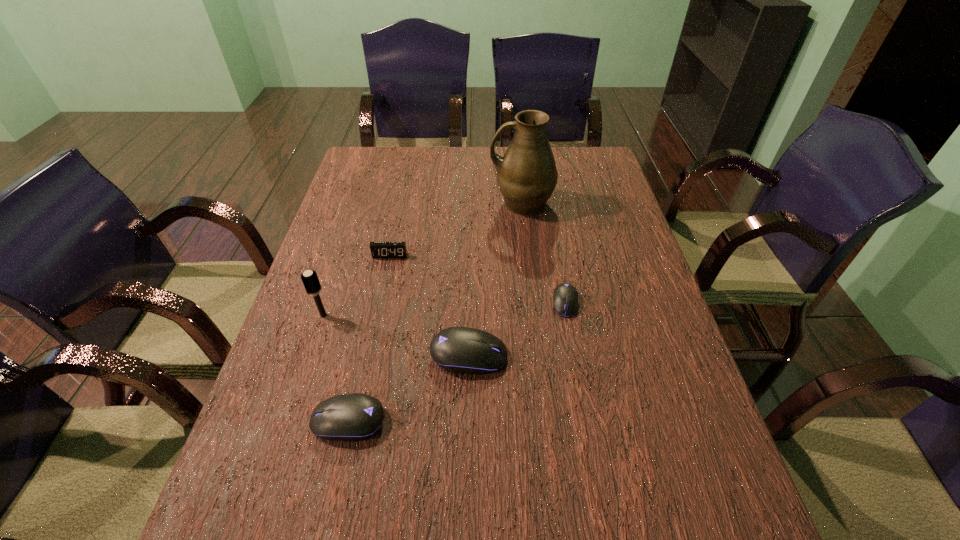
Identify the location of the nearest object. (351, 417).

Where is `the nearest computer mouse`? the nearest computer mouse is located at coordinates (351, 417).

Locate an element on the screen. The image size is (960, 540). the second nearest object is located at coordinates (462, 350).

You are a GUI agent. You are given a task and a screenshot of the screen. Output one action in this format:
    pyautogui.click(x=<x>, y=<y>)
    Task: Click on the second computer mouse from right to left
    Image resolution: width=960 pixels, height=540 pixels.
    Given the screenshot: What is the action you would take?
    pyautogui.click(x=462, y=350)

Locate an element on the screen. The width and height of the screenshot is (960, 540). the rightmost computer mouse is located at coordinates (565, 298).

At what (x,y) coordinates should I click in order to perform the action: click on the farthest computer mouse. Please return your answer as a coordinate pair (x, y). The image size is (960, 540). Looking at the image, I should click on (565, 298).

This screenshot has height=540, width=960. Find the location of `the fifth nearest object`. the fifth nearest object is located at coordinates (378, 249).

I want to click on the tallest object, so click(x=527, y=175).

Locate an element on the screen. pitcher is located at coordinates (527, 175).

I want to click on the leftmost object, so click(x=309, y=278).